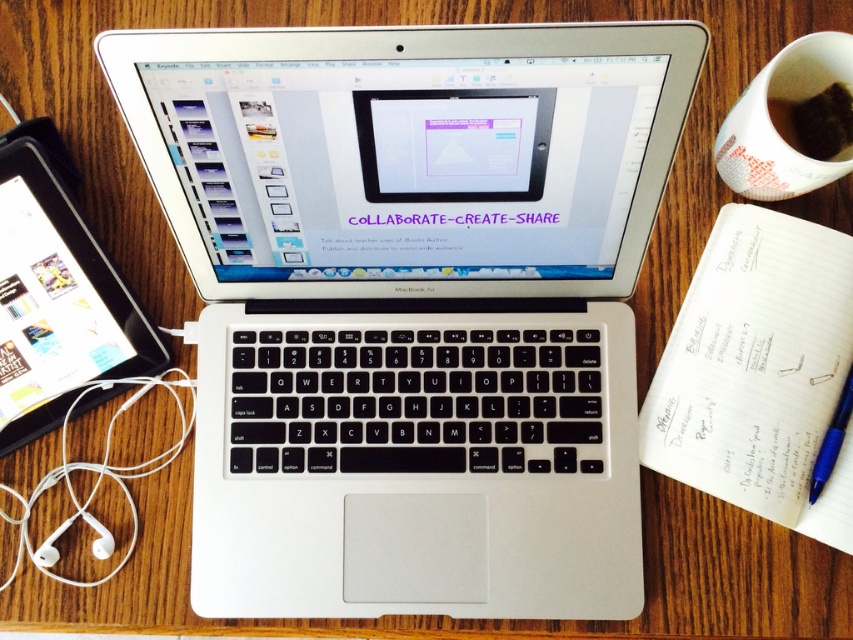
Can you confirm if white paper notepad at lower right is shorter than blue metallic pen at lower right?

In fact, white paper notepad at lower right may be taller than blue metallic pen at lower right.

Does point (827, 284) lie in front of point (810, 484)?

No, (827, 284) is behind (810, 484).

Where is `white paper notepad at lower right`? The image size is (853, 640). white paper notepad at lower right is located at coordinates (758, 371).

Is white paper notepad at lower right taller than brown matte cup at upper right?

Indeed, white paper notepad at lower right has a greater height compared to brown matte cup at upper right.

Measure the distance between point (831, 513) and camera.

Point (831, 513) is 28.27 inches from camera.

Is point (779, 307) positioned before point (817, 108)?

No, (779, 307) is further to viewer.

Locate an element on the screen. white paper notepad at lower right is located at coordinates [758, 371].

Consider the image. Who is shorter, silver metallic laptop at center or blue metallic pen at lower right?

With less height is blue metallic pen at lower right.

Locate an element on the screen. silver metallic laptop at center is located at coordinates (412, 305).

Does point (555, 538) come in front of point (830, 428)?

Yes, point (555, 538) is closer to viewer.

Identify the location of silver metallic laptop at center. This screenshot has width=853, height=640. (412, 305).